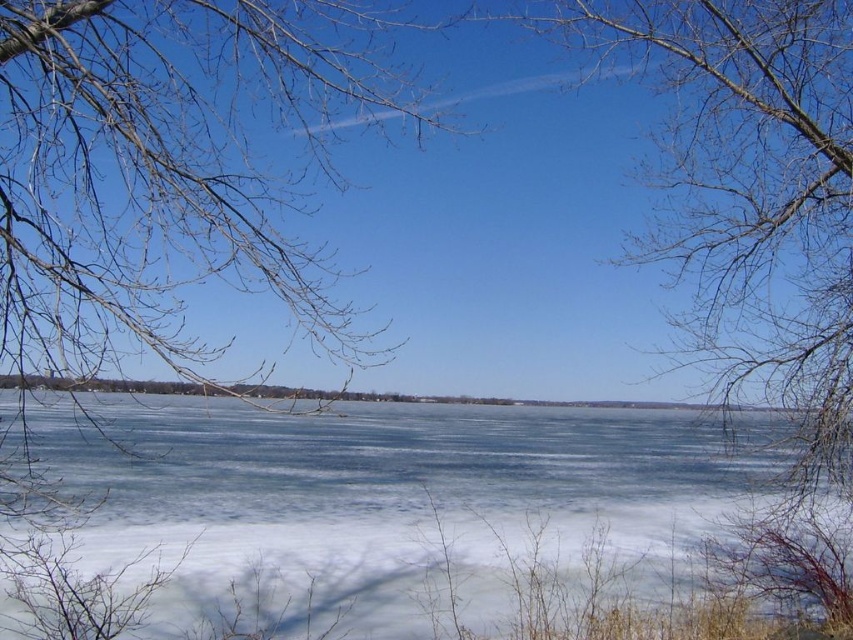
Question: Is white ice at center further to camera compared to bare branches at upper left?

Choices:
 (A) yes
 (B) no

Answer: (B)

Question: Which object appears closest to the camera in this image?

Choices:
 (A) bare branches at upper left
 (B) white ice at center

Answer: (B)

Question: In this image, where is white ice at center located relative to bare branches at upper left?

Choices:
 (A) below
 (B) above

Answer: (A)

Question: Does white ice at center have a smaller size compared to bare branches at upper left?

Choices:
 (A) no
 (B) yes

Answer: (B)

Question: Which point is closer to the camera?

Choices:
 (A) (86, 483)
 (B) (791, 205)

Answer: (B)